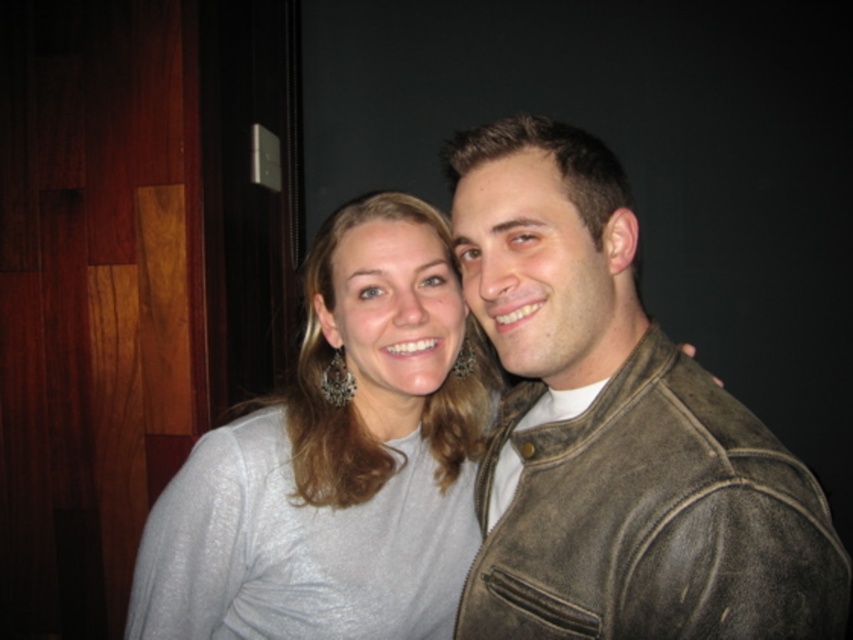
You are trying to decide which item to take with you for a trip. You have space for one item only. The distressed leather jacket at right and the gray matte sweater at center are both options. Which item is narrower and would fit better in your limited space?

The distressed leather jacket at right is narrower than the gray matte sweater at center, so it would fit better in limited space.

You are a photographer setting up for a group photo. You need to ensure that the two subjects are at least 8 inches apart for proper lighting. Based on the scene, can the distressed leather jacket at right and the gray matte sweater at center be positioned to meet this requirement?

The distance between the distressed leather jacket at right and the gray matte sweater at center is 7.41 inches, which is less than the required 8 inches. Therefore, they need to move further apart to meet the lighting requirement.